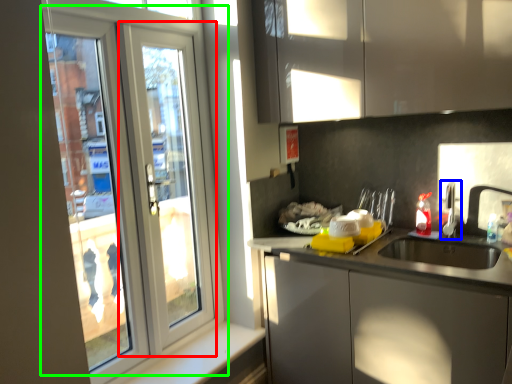
Question: Considering the real-world distances, which object is farthest from screen door (highlighted by a red box)? tap (highlighted by a blue box) or door (highlighted by a green box)?

Choices:
 (A) tap
 (B) door

Answer: (A)